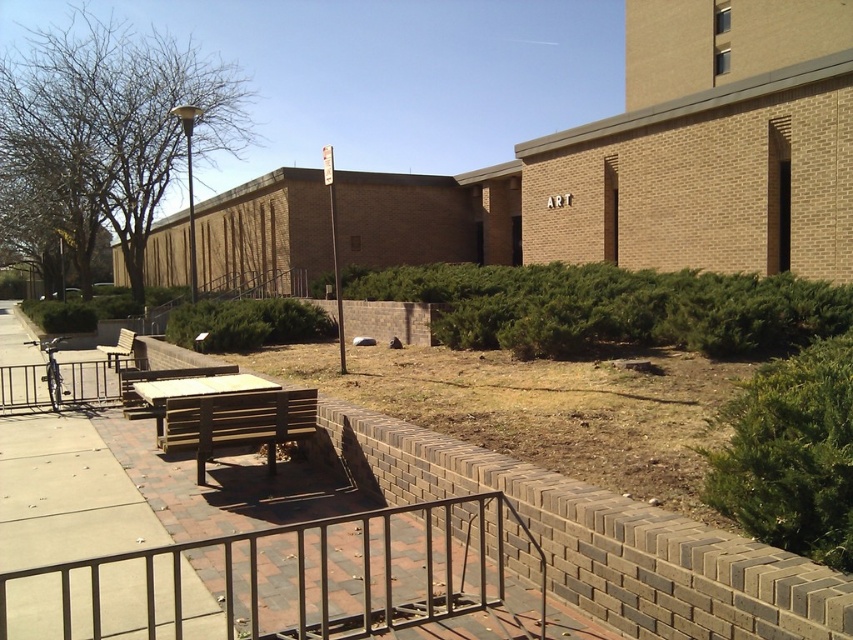
Question: Is metal at lower center to the left of green leafy hedge at lower right from the viewer's perspective?

Choices:
 (A) no
 (B) yes

Answer: (B)

Question: Considering the relative positions of wooden bench at center and green shrub at center in the image provided, where is wooden bench at center located with respect to green shrub at center?

Choices:
 (A) right
 (B) left

Answer: (A)

Question: Which of these objects is positioned farthest from the wooden picnic table at center?

Choices:
 (A) wooden park bench at left
 (B) wooden park bench at center

Answer: (A)

Question: Which of these objects is positioned closest to the wooden picnic table at center?

Choices:
 (A) green shrub at center
 (B) metallic silver railing at left

Answer: (B)

Question: Is green leafy hedge at center thinner than wooden park bench at left?

Choices:
 (A) no
 (B) yes

Answer: (A)

Question: Which object appears closest to the camera in this image?

Choices:
 (A) metallic silver railing at left
 (B) wooden park bench at center

Answer: (B)